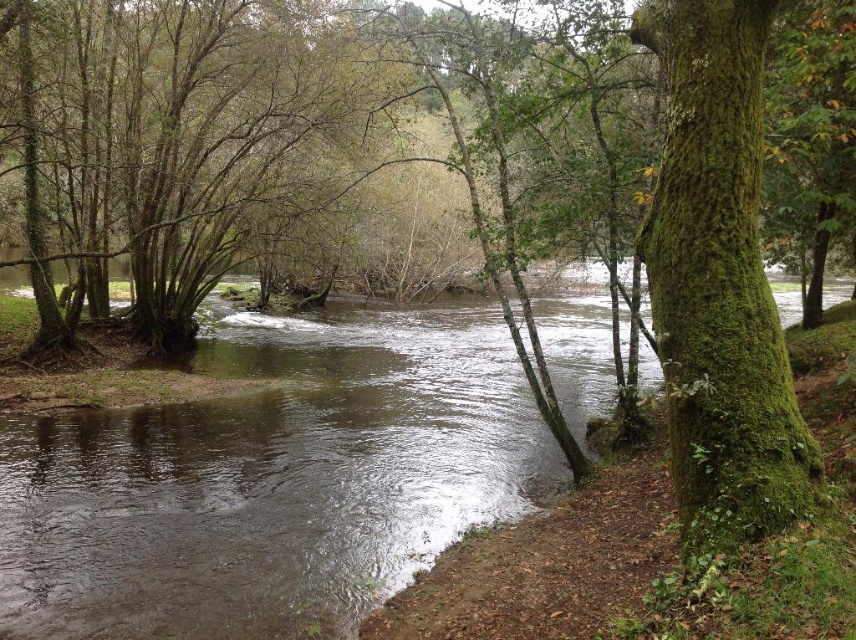
You are standing on the riverbank and want to cross the river to the tree on the right. Can you step onto the clear water at center to reach the green mossy tree at right?

The clear water at center is located above the green mossy tree at right, meaning the water is upstream from the tree. Since the tree is downstream, you can safely step onto the clear water at center to cross towards the green mossy tree at right.

You are planning to cross the river using a small wooden raft that can only hold items up to the size of the green mossy tree at right. You have a large backpack that is the size of the clear water at center. Can you safely carry your backpack across the river on the raft?

The clear water at center is bigger than the green mossy tree at right. Since your backpack is the size of the clear water at center, it is larger than the maximum capacity of the raft, which can only hold items up to the size of the green mossy tree at right. Therefore, you cannot safely carry your backpack across the river on the raft.